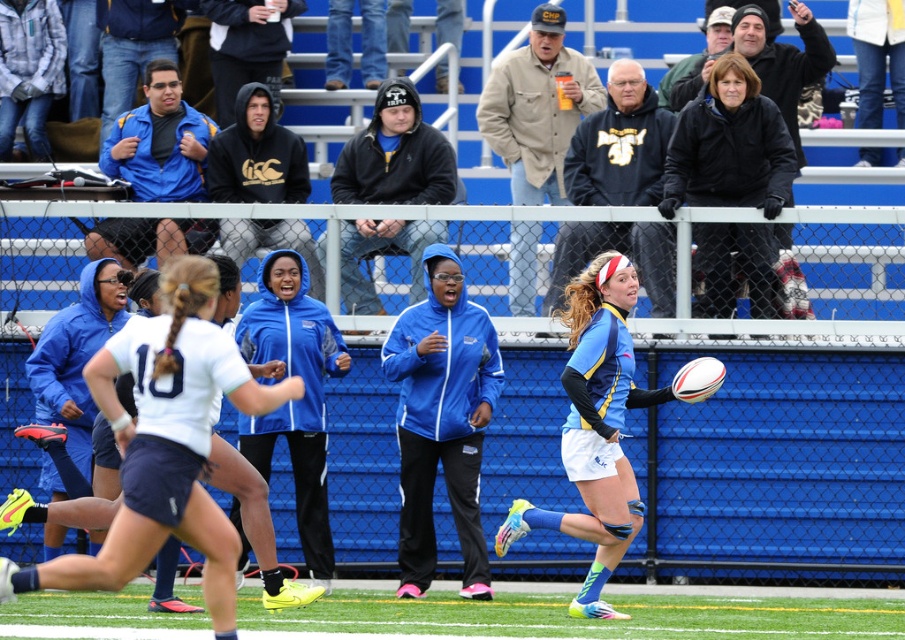
You are a photographer standing at the edge of the rugby field. You want to take a photo that includes both the light blue jersey at center and the black matte jacket at upper right. Given that your camera has a maximum focus range of 13 feet, will you be able to capture both subjects in focus?

The light blue jersey at center and the black matte jacket at upper right are 13.18 feet apart. Since the distance between them exceeds the camera maximum focus range of 13 feet, you will not be able to capture both subjects in focus.

You are a photographer at the rugby match. You want to take a photo that includes both the light blue jersey at center and the black matte jacket at upper right. Based on their positions, which object should you focus on first to ensure both are in frame?

The light blue jersey at center is located below the black matte jacket at upper right. To include both in the frame, focus on the black matte jacket at upper right first, as it is higher up, then adjust the camera angle downward to include the light blue jersey at center.